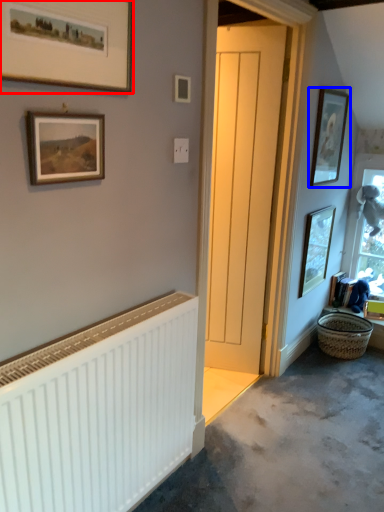
Question: Which object is closer to the camera taking this photo, picture frame (highlighted by a red box) or picture frame (highlighted by a blue box)?

Choices:
 (A) picture frame
 (B) picture frame

Answer: (A)